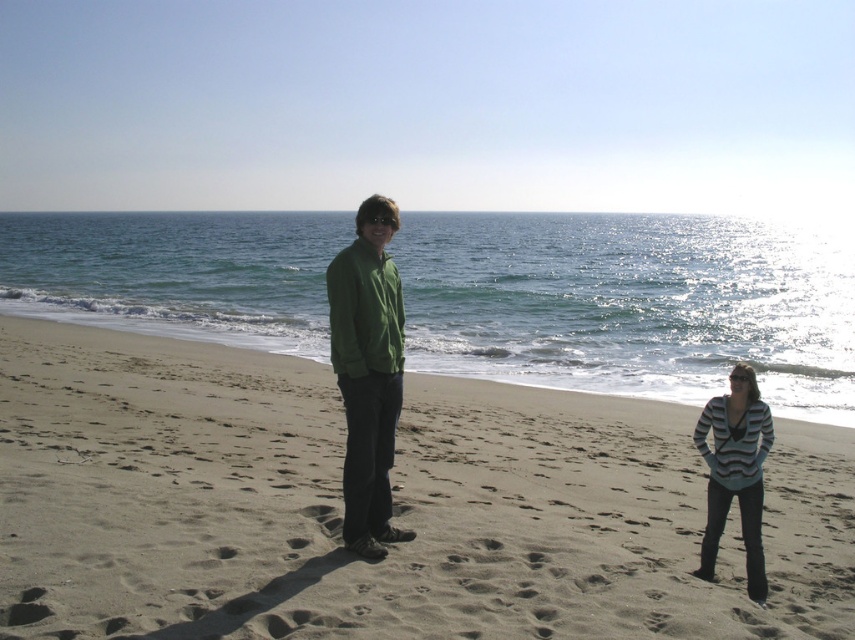
Does brown sandy beach at center appear on the left side of striped sweater at lower right?

Correct, you'll find brown sandy beach at center to the left of striped sweater at lower right.

Consider the image. Is brown sandy beach at center to the right of striped sweater at lower right from the viewer's perspective?

Incorrect, brown sandy beach at center is not on the right side of striped sweater at lower right.

Between point (434, 570) and point (750, 388), which one is positioned behind?

The point (750, 388) is more distant.

Where is `brown sandy beach at center`? This screenshot has width=855, height=640. brown sandy beach at center is located at coordinates [393, 506].

Can you confirm if brown sandy beach at center is bigger than green matte jacket at center?

Yes.

Is point (13, 440) more distant than point (380, 208)?

That is True.

Locate an element on the screen. The image size is (855, 640). brown sandy beach at center is located at coordinates click(393, 506).

Consider the image. Is the position of green matte jacket at center more distant than that of striped sweater at lower right?

No.

This screenshot has width=855, height=640. Find the location of `green matte jacket at center`. green matte jacket at center is located at coordinates (367, 372).

Is point (364, 522) positioned behind point (752, 545)?

No, it is in front of (752, 545).

Image resolution: width=855 pixels, height=640 pixels. I want to click on green matte jacket at center, so click(367, 372).